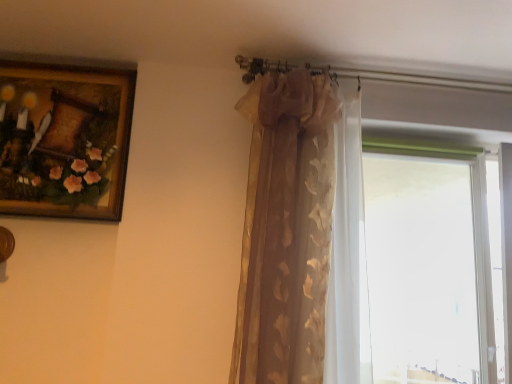
Question: Considering the relative sizes of wooden framed painting at upper left and transparent glass window at right in the image provided, is wooden framed painting at upper left thinner than transparent glass window at right?

Choices:
 (A) yes
 (B) no

Answer: (B)

Question: Would you say transparent glass window at right is part of wooden framed painting at upper left's contents?

Choices:
 (A) yes
 (B) no

Answer: (B)

Question: Is wooden framed painting at upper left shorter than transparent glass window at right?

Choices:
 (A) yes
 (B) no

Answer: (A)

Question: From the image's perspective, is wooden framed painting at upper left on top of transparent glass window at right?

Choices:
 (A) yes
 (B) no

Answer: (A)

Question: Does wooden framed painting at upper left appear on the right side of transparent glass window at right?

Choices:
 (A) no
 (B) yes

Answer: (A)

Question: From the image's perspective, is wooden framed painting at upper left located beneath transparent glass window at right?

Choices:
 (A) no
 (B) yes

Answer: (A)

Question: Does gold textured curtain at upper center turn towards transparent glass window at right?

Choices:
 (A) no
 (B) yes

Answer: (A)

Question: From the image's perspective, is gold textured curtain at upper center above transparent glass window at right?

Choices:
 (A) yes
 (B) no

Answer: (A)

Question: Is gold textured curtain at upper center in contact with transparent glass window at right?

Choices:
 (A) no
 (B) yes

Answer: (A)

Question: Considering the relative sizes of gold textured curtain at upper center and transparent glass window at right in the image provided, is gold textured curtain at upper center thinner than transparent glass window at right?

Choices:
 (A) no
 (B) yes

Answer: (A)

Question: Can you confirm if gold textured curtain at upper center is bigger than transparent glass window at right?

Choices:
 (A) no
 (B) yes

Answer: (B)

Question: Would you say gold textured curtain at upper center is a long distance from transparent glass window at right?

Choices:
 (A) yes
 (B) no

Answer: (A)

Question: Is gold textured curtain at upper center closer to camera compared to wooden framed painting at upper left?

Choices:
 (A) no
 (B) yes

Answer: (B)